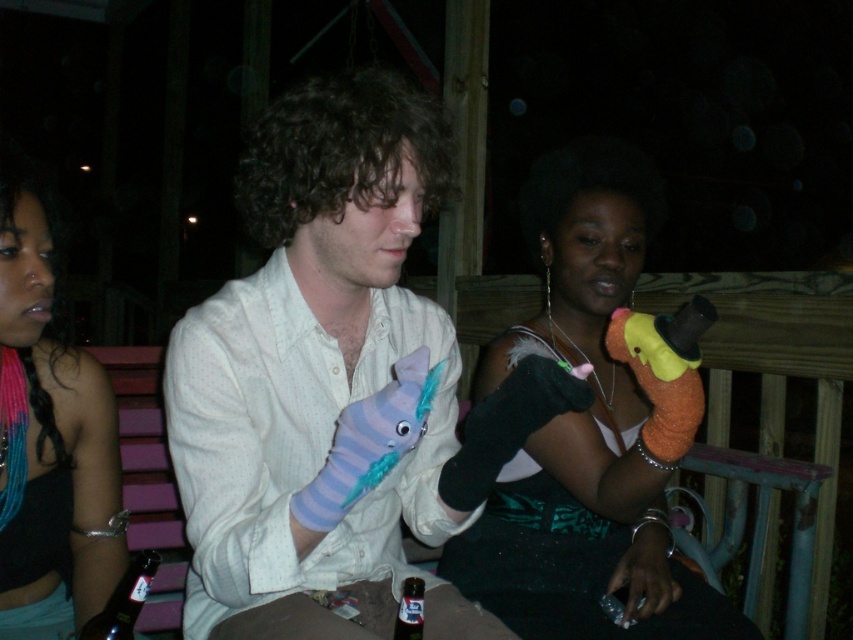
In the scene shown: Where is the orange fuzzy glove at center located in the image?

The orange fuzzy glove at center is located at point 0.669 on the x axis and 0.696 on the y axis.